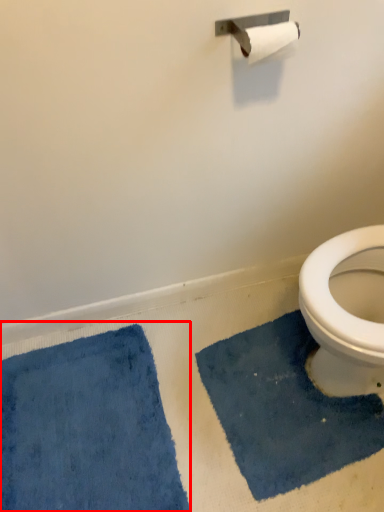
Question: From the image's perspective, where is bath mat (annotated by the red box) located relative to bath mat?

Choices:
 (A) below
 (B) above

Answer: (A)